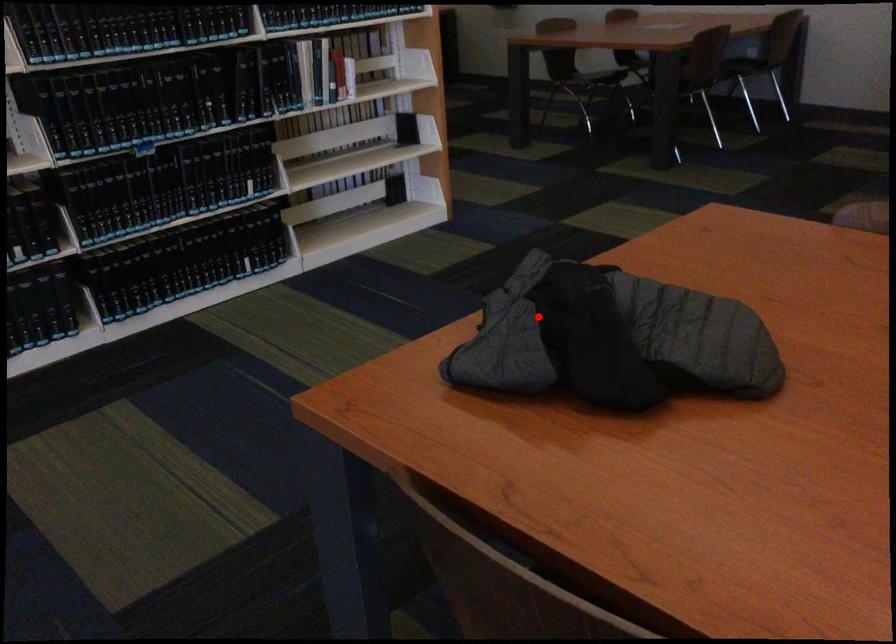
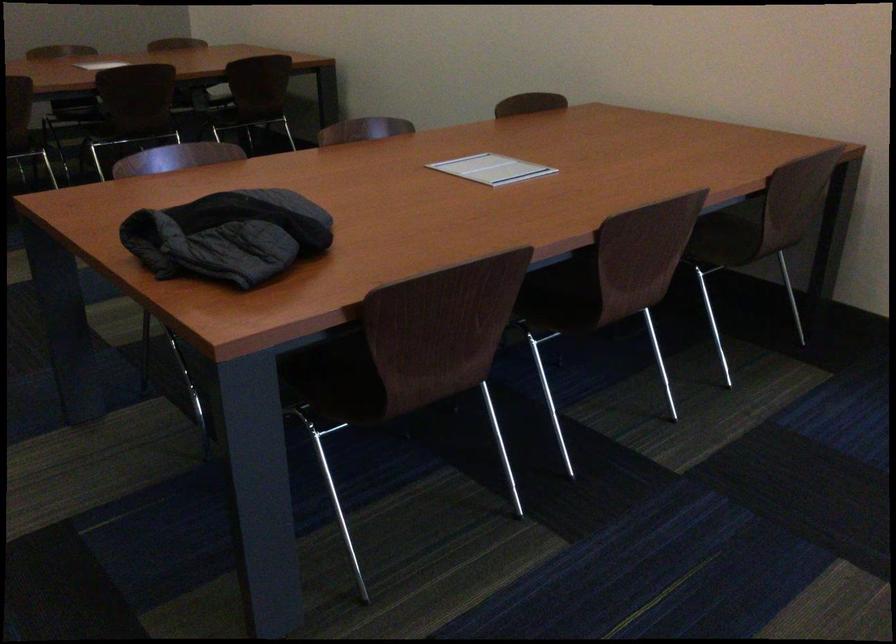
Find the pixel in the second image that matches the highlighted location in the first image.

(228, 236)